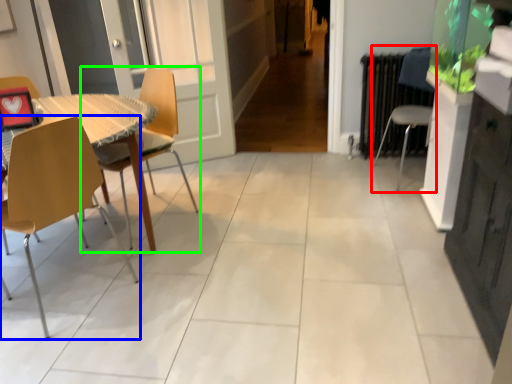
Question: Which object is the farthest from chair (highlighted by a red box)? Choose among these: chair (highlighted by a blue box) or chair (highlighted by a green box).

Choices:
 (A) chair
 (B) chair

Answer: (A)